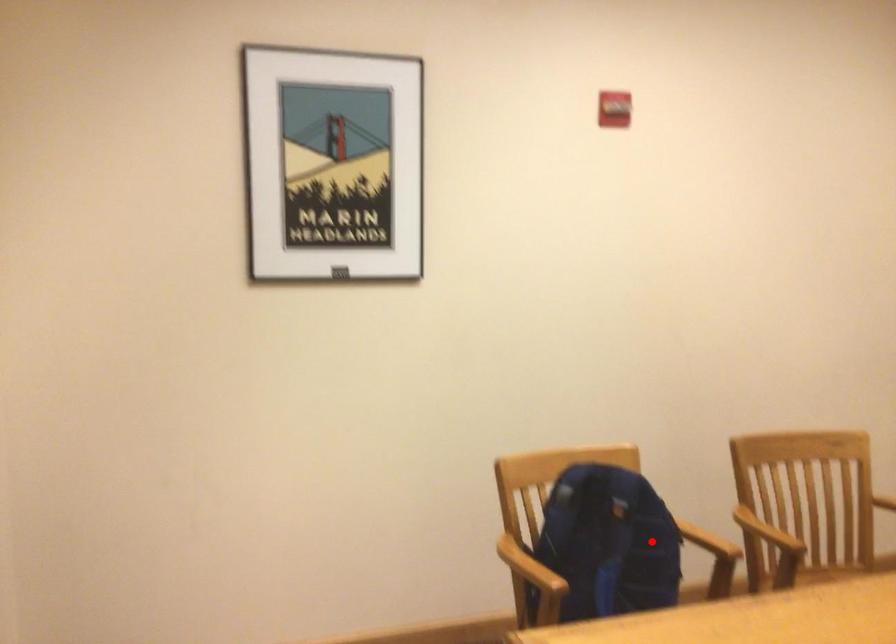
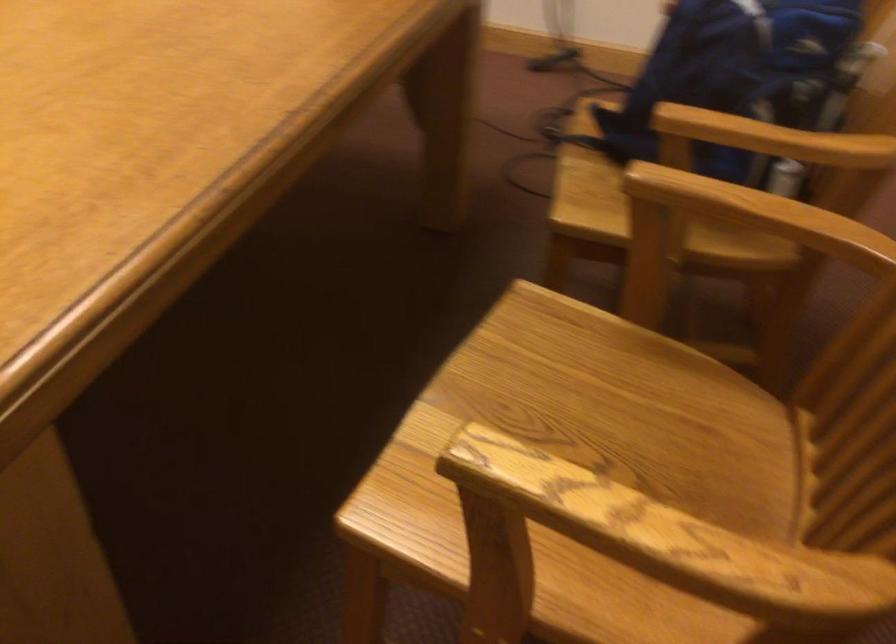
Question: A red point is marked in image1. In image2, is the corresponding 3D point closer to the camera or farther? Reply with the corresponding letter.

Choices:
 (A) The corresponding 3D point is closer.
 (B) The corresponding 3D point is farther.

Answer: (A)